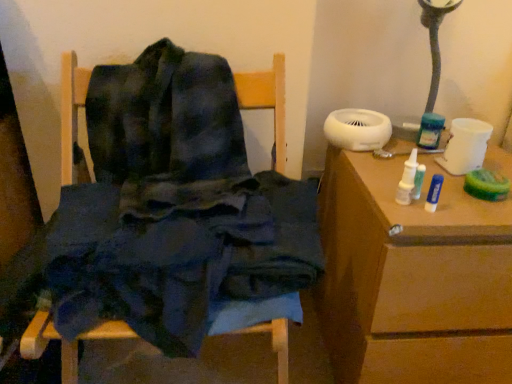
What do you see at coordinates (412, 279) in the screenshot?
I see `brown wooden table at right` at bounding box center [412, 279].

Where is `brown wooden table at right`? This screenshot has height=384, width=512. brown wooden table at right is located at coordinates [412, 279].

Describe the element at coordinates (267, 100) in the screenshot. I see `dark blue fabric at center` at that location.

What is the approximate width of dark blue fabric at center?

The width of dark blue fabric at center is 18.67 inches.

Image resolution: width=512 pixels, height=384 pixels. In order to click on dark blue fabric at center in this screenshot , I will do `click(267, 100)`.

Locate an element on the screen. The width and height of the screenshot is (512, 384). brown wooden table at right is located at coordinates (412, 279).

Is dark blue fabric at center at the right side of brown wooden table at right?

No.

Which is in front, dark blue fabric at center or brown wooden table at right?

dark blue fabric at center.

Is point (252, 92) farther from camera compared to point (355, 203)?

No, (252, 92) is closer to viewer.

From the image's perspective, is dark blue fabric at center over brown wooden table at right?

Yes.

From a real-world perspective, is dark blue fabric at center beneath brown wooden table at right?

No, from a real-world perspective, dark blue fabric at center is not under brown wooden table at right.

Considering the relative sizes of dark blue fabric at center and brown wooden table at right in the image provided, is dark blue fabric at center wider than brown wooden table at right?

In fact, dark blue fabric at center might be narrower than brown wooden table at right.

Who is shorter, dark blue fabric at center or brown wooden table at right?

Standing shorter between the two is brown wooden table at right.

Considering the relative sizes of dark blue fabric at center and brown wooden table at right in the image provided, is dark blue fabric at center smaller than brown wooden table at right?

No.

Is dark blue fabric at center spatially inside brown wooden table at right, or outside of it?

dark blue fabric at center cannot be found inside brown wooden table at right.

Based on the photo, are dark blue fabric at center and brown wooden table at right making contact?

No, dark blue fabric at center is not with brown wooden table at right.

Does dark blue fabric at center turn towards brown wooden table at right?

No.

How many degrees apart are the facing directions of dark blue fabric at center and brown wooden table at right?

The angular difference between dark blue fabric at center and brown wooden table at right is 2.02 degrees.

You are a GUI agent. You are given a task and a screenshot of the screen. Output one action in this format:
    pyautogui.click(x=<x>, y=<y>)
    Task: Click on the table located underneath the dark blue fabric at center (from a real-world perspective)
    Image resolution: width=512 pixels, height=384 pixels.
    Given the screenshot: What is the action you would take?
    pyautogui.click(x=412, y=279)

Considering the relative positions of brown wooden table at right and dark blue fabric at center in the image provided, is brown wooden table at right to the left of dark blue fabric at center from the viewer's perspective?

Incorrect, brown wooden table at right is not on the left side of dark blue fabric at center.

Which object is further away from the camera taking this photo, brown wooden table at right or dark blue fabric at center?

brown wooden table at right is further from the camera.

Which is more distant, (370, 322) or (46, 333)?

Point (370, 322)

From the image's perspective, would you say brown wooden table at right is positioned over dark blue fabric at center?

Incorrect, from the image's perspective, brown wooden table at right is lower than dark blue fabric at center.

From a real-world perspective, is brown wooden table at right beneath dark blue fabric at center?

Indeed, from a real-world perspective, brown wooden table at right is positioned beneath dark blue fabric at center.

Can you confirm if brown wooden table at right is thinner than dark blue fabric at center?

No.

Based on the photo, who is shorter, brown wooden table at right or dark blue fabric at center?

Standing shorter between the two is brown wooden table at right.

Which of these two, brown wooden table at right or dark blue fabric at center, is bigger?

dark blue fabric at center is bigger.

Is brown wooden table at right surrounding dark blue fabric at center?

No, brown wooden table at right does not contain dark blue fabric at center.

Is brown wooden table at right placed right next to dark blue fabric at center?

brown wooden table at right and dark blue fabric at center are not in contact.

Is brown wooden table at right positioned with its back to dark blue fabric at center?

No, brown wooden table at right is not facing away from dark blue fabric at center.

Find the location of `table below the dark blue fabric at center (from a real-world perspective)`. table below the dark blue fabric at center (from a real-world perspective) is located at coordinates (412, 279).

Find the location of `furniture in front of the brown wooden table at right`. furniture in front of the brown wooden table at right is located at coordinates (267, 100).

At what (x,y) coordinates should I click in order to perform the action: click on table below the dark blue fabric at center (from the image's perspective). Please return your answer as a coordinate pair (x, y). Looking at the image, I should click on point(412,279).